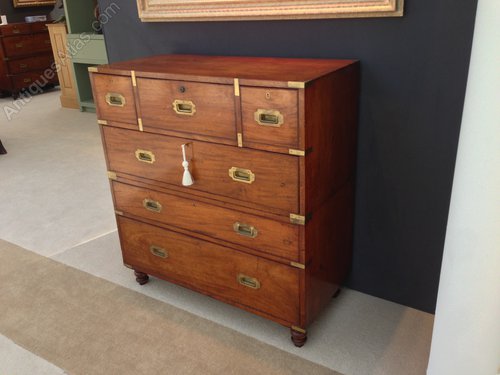
Find the location of a particular element. handle is located at coordinates (269, 119).